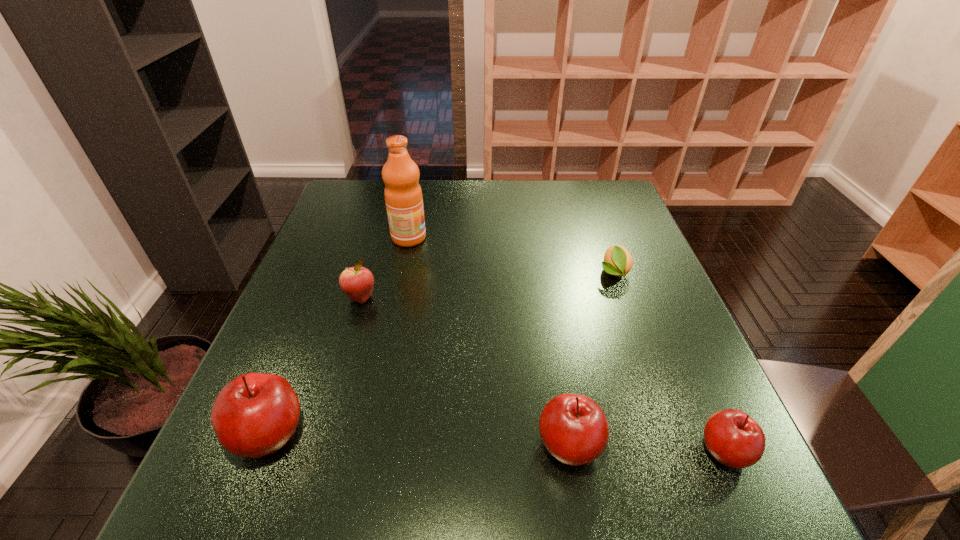
Locate an element on the screen. Image resolution: width=960 pixels, height=540 pixels. vacant space at the right edge of the desktop is located at coordinates (676, 349).

Find the location of a particular element. This screenshot has width=960, height=540. free space at the far right corner of the desktop is located at coordinates click(x=630, y=216).

This screenshot has height=540, width=960. I want to click on unoccupied position between the third object from right to left and the farthest object, so click(490, 341).

You are a GUI agent. You are given a task and a screenshot of the screen. Output one action in this format:
    pyautogui.click(x=<x>, y=<y>)
    Task: Click on the empty location between the tallest object and the third object from right to left
    
    Given the screenshot: What is the action you would take?
    pyautogui.click(x=490, y=341)

Where is `blank region between the farthest apple and the tallest object`? The image size is (960, 540). blank region between the farthest apple and the tallest object is located at coordinates (385, 268).

At what (x,y) coordinates should I click in order to perform the action: click on vacant area that lies between the farthest object and the second shortest object. Please return your answer as a coordinate pair (x, y). The width and height of the screenshot is (960, 540). Looking at the image, I should click on (566, 344).

Where is `free space between the fifth tallest object and the fourth object from left to right`? This screenshot has width=960, height=540. free space between the fifth tallest object and the fourth object from left to right is located at coordinates (647, 448).

At what (x,y) coordinates should I click in order to perform the action: click on free spot between the second apple from right to left and the fruit juice. Please return your answer as a coordinate pair (x, y). The width and height of the screenshot is (960, 540). Looking at the image, I should click on (490, 341).

Identify the location of vacant point located between the farthest apple and the second apple from right to left. (466, 372).

This screenshot has width=960, height=540. In order to click on free space that is in between the farthest apple and the shortest object in this screenshot , I will do `click(487, 285)`.